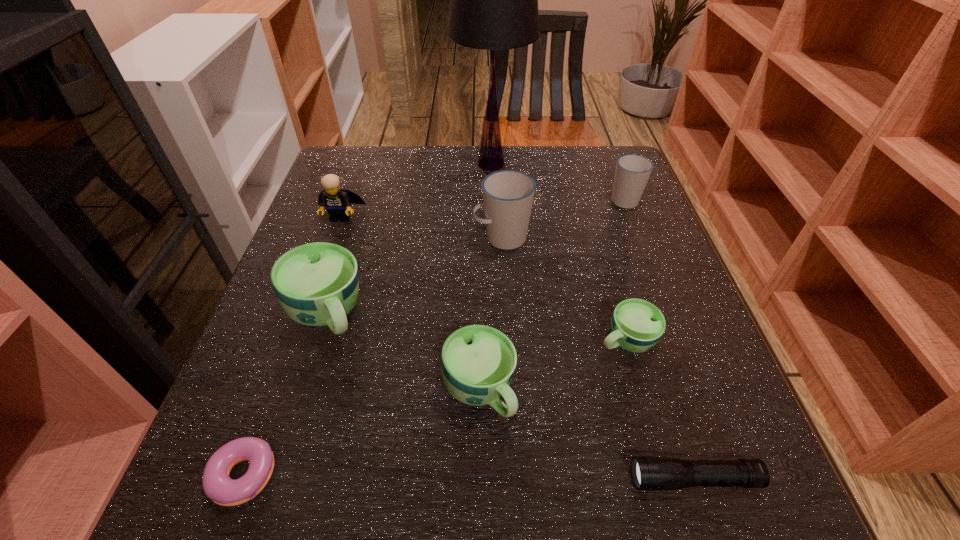
Image resolution: width=960 pixels, height=540 pixels. I want to click on free space between the sixth tallest object and the eighth tallest object, so click(586, 435).

At what (x,y) coordinates should I click in order to perform the action: click on free spot between the Lego and the shortest object. Please return your answer as a coordinate pair (x, y). This screenshot has width=960, height=540. Looking at the image, I should click on (291, 349).

At what (x,y) coordinates should I click in order to perform the action: click on vacant region between the shortest object and the black flashlight. Please return your answer as a coordinate pair (x, y). The height and width of the screenshot is (540, 960). Looking at the image, I should click on (468, 481).

What are the coordinates of `vacant point located between the second farthest cup and the purple doughnut` in the screenshot? It's located at (372, 360).

This screenshot has height=540, width=960. I want to click on unoccupied area between the Lego and the tallest object, so click(416, 190).

I want to click on vacant space in between the left white cup and the black flashlight, so click(x=597, y=359).

You are a GUI agent. You are given a task and a screenshot of the screen. Output one action in this format:
    pyautogui.click(x=<x>, y=<y>)
    Task: Click on the free space between the shortest object and the seventh tallest object
    This screenshot has height=540, width=960.
    Given the screenshot: What is the action you would take?
    pyautogui.click(x=433, y=411)

I want to click on vacant space in between the lampshade and the third shortest object, so click(x=558, y=252).

Identify the location of vacant space that's between the second shortest cup and the farthest cup. (551, 295).

In order to click on vacant point located between the sixth tallest object and the bigger white cup in this screenshot , I will do pyautogui.click(x=491, y=314).